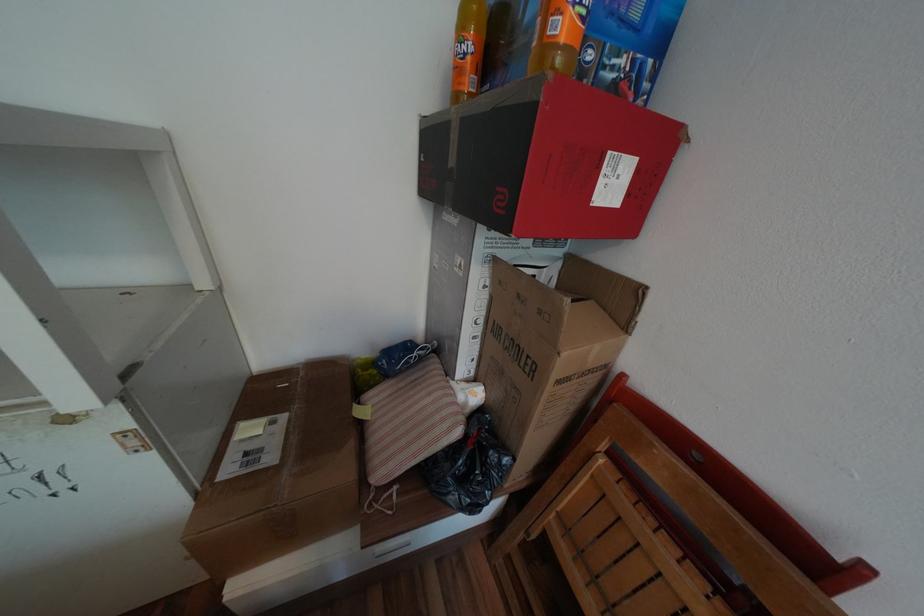
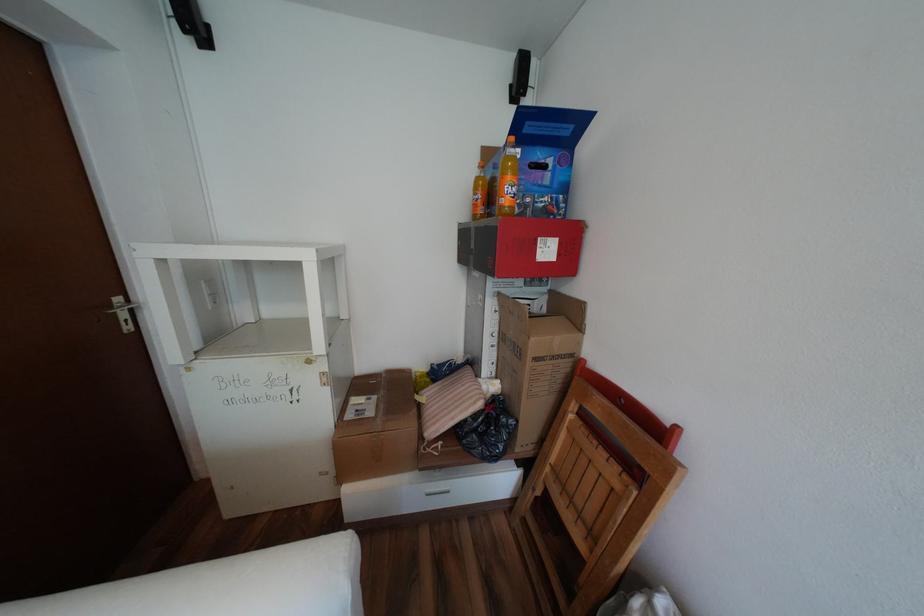
Where in the second image is the point corresponding to (x=490, y=321) from the first image?

(505, 334)